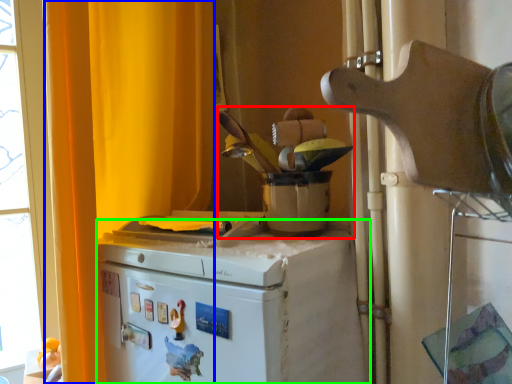
Question: Which object is the closest to the appliance (highlighted by a red box)? Choose among these: curtain (highlighted by a blue box) or home appliance (highlighted by a green box).

Choices:
 (A) curtain
 (B) home appliance

Answer: (B)